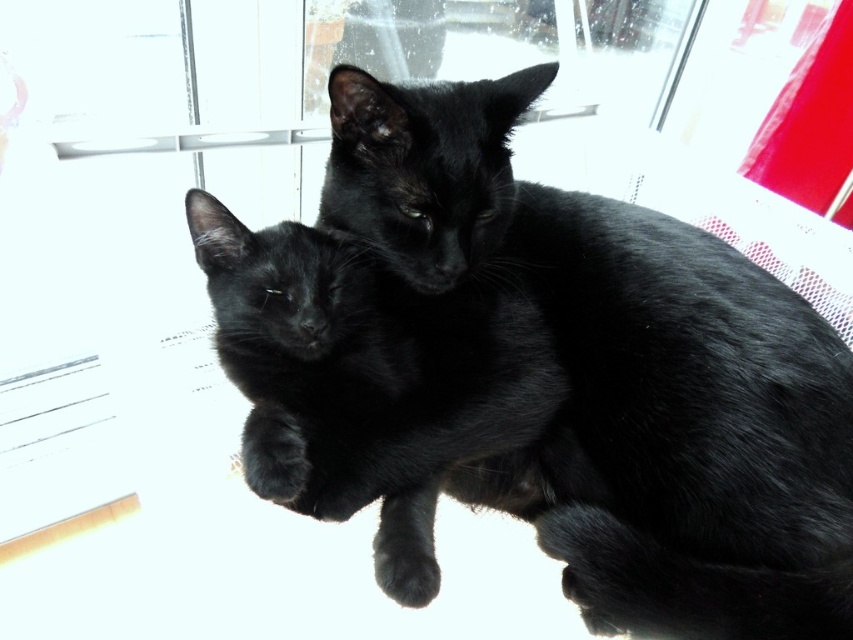
Question: Observing the image, what is the correct spatial positioning of black fur cat at center in reference to black fur paw at lower left?

Choices:
 (A) below
 (B) above

Answer: (B)

Question: Among these objects, which one is nearest to the camera?

Choices:
 (A) black fur paw at lower left
 (B) black fur cat at center

Answer: (B)

Question: Does black fur cat at center appear on the left side of black fur paw at lower left?

Choices:
 (A) no
 (B) yes

Answer: (A)

Question: Considering the relative positions of black fur cat at center and black fur paw at lower left in the image provided, where is black fur cat at center located with respect to black fur paw at lower left?

Choices:
 (A) above
 (B) below

Answer: (A)

Question: Which point is farther to the camera?

Choices:
 (A) (451, 300)
 (B) (283, 500)

Answer: (A)